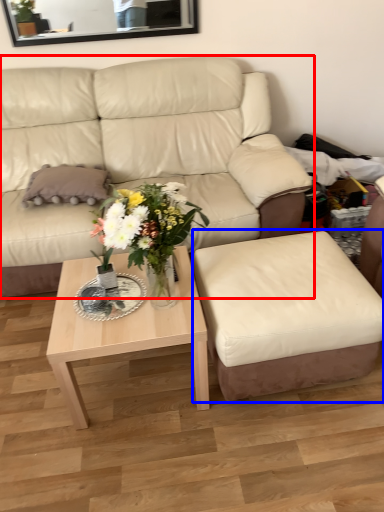
Question: Which of the following is the farthest to the observer, studio couch (highlighted by a red box) or swivel chair (highlighted by a blue box)?

Choices:
 (A) studio couch
 (B) swivel chair

Answer: (A)